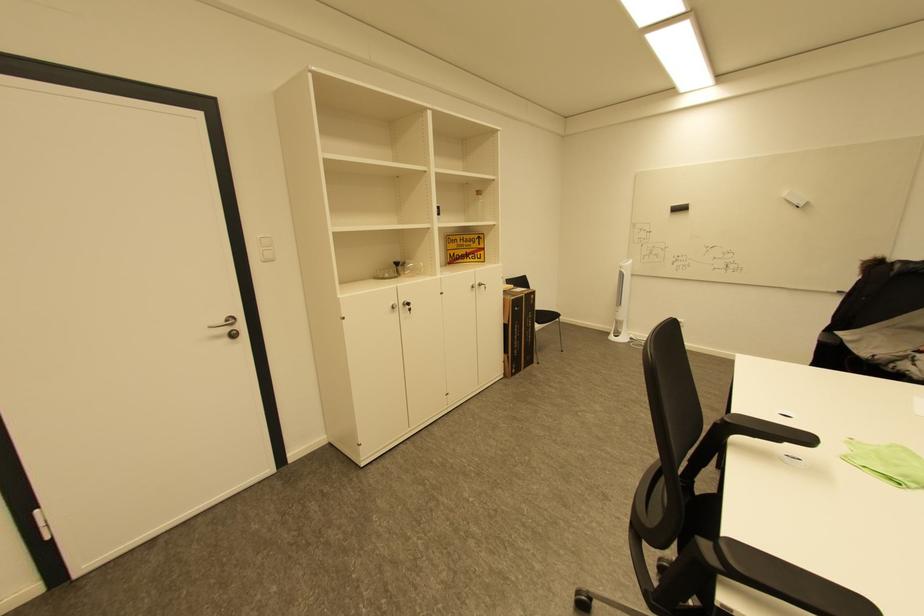
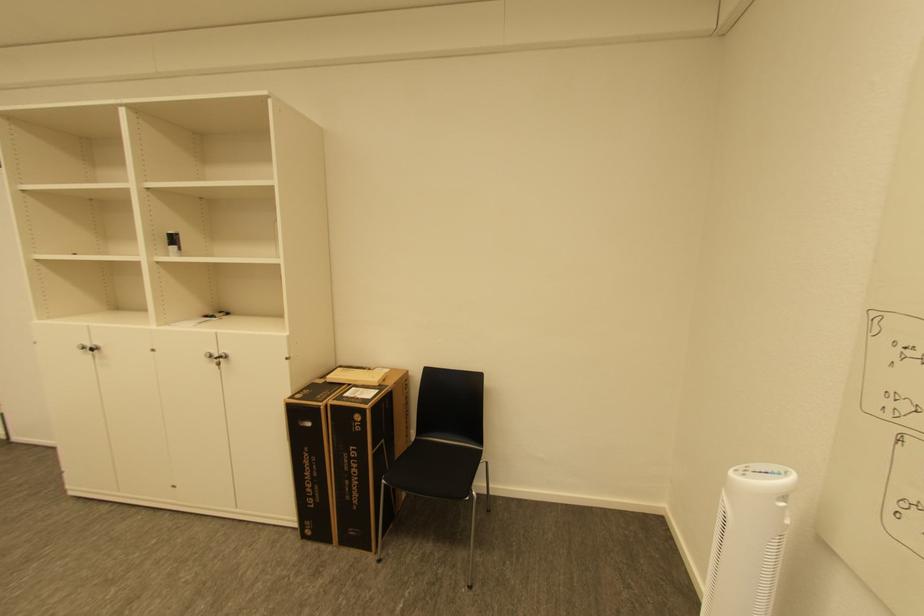
Locate, in the second image, the point that corresponds to the point at 539,297 in the first image.

(363, 418)